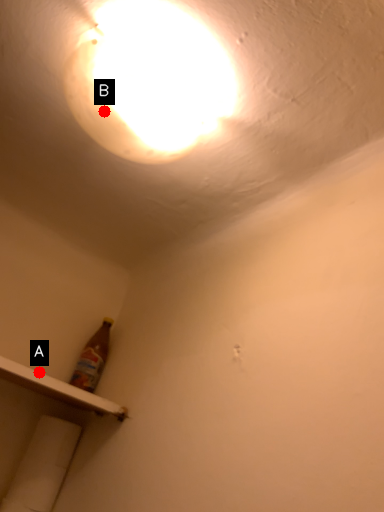
Question: Two points are circled on the image, labeled by A and B beside each circle. Among these points, which one is farthest from the camera?

Choices:
 (A) A is further
 (B) B is further

Answer: (A)